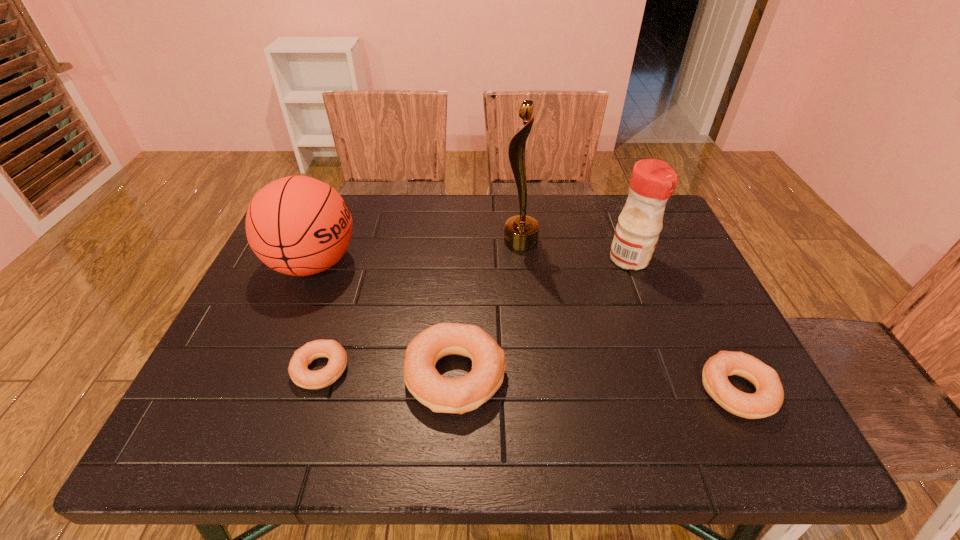
Where is `object that is at the left edge`? Image resolution: width=960 pixels, height=540 pixels. object that is at the left edge is located at coordinates (297, 225).

What are the coordinates of `bagel that is at the right edge` in the screenshot? It's located at pyautogui.click(x=768, y=398).

You are a GUI agent. You are given a task and a screenshot of the screen. Output one action in this format:
    pyautogui.click(x=<x>, y=<y>)
    Task: Click on the condiment positioned at the right edge
    The height and width of the screenshot is (540, 960).
    Given the screenshot: What is the action you would take?
    pyautogui.click(x=652, y=183)

This screenshot has height=540, width=960. Find the location of `object at the far left corner`. object at the far left corner is located at coordinates (297, 225).

Where is `object that is at the near right corner`? The image size is (960, 540). object that is at the near right corner is located at coordinates (768, 398).

This screenshot has width=960, height=540. I want to click on vacant space at the far edge of the desktop, so click(453, 199).

Identify the location of free location at the near edge. The image size is (960, 540). (355, 398).

What are the coordinates of `free space at the left edge of the desktop` in the screenshot? It's located at (247, 296).

This screenshot has height=540, width=960. Find the location of `vacant area at the right edge`. vacant area at the right edge is located at coordinates (669, 332).

In the image, there is a desktop. Identify the location of vacant space at the near right corner. (685, 382).